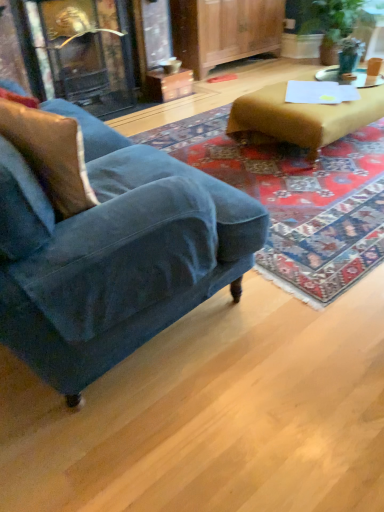
Question: Considering the positions of velvet brown pillow at left and velvet blue couch at lower left in the image, is velvet brown pillow at left taller or shorter than velvet blue couch at lower left?

Choices:
 (A) short
 (B) tall

Answer: (A)

Question: Considering the relative positions of velvet brown pillow at left and velvet blue couch at lower left in the image provided, is velvet brown pillow at left to the left or to the right of velvet blue couch at lower left?

Choices:
 (A) right
 (B) left

Answer: (A)

Question: Estimate the real-world distances between objects in this image. Which object is closer to the white glossy side table at upper right?

Choices:
 (A) teal glass at upper right
 (B) velvet brown pillow at left
 (C) velvet blue armchair at left
 (D) velvet blue couch at lower left
 (E) brown leather ottoman at upper right

Answer: (A)

Question: Which is nearer to the brown leather ottoman at upper right?

Choices:
 (A) velvet brown pillow at left
 (B) white glossy side table at upper right
 (C) velvet blue armchair at left
 (D) teal glass at upper right
 (E) velvet blue couch at lower left

Answer: (C)